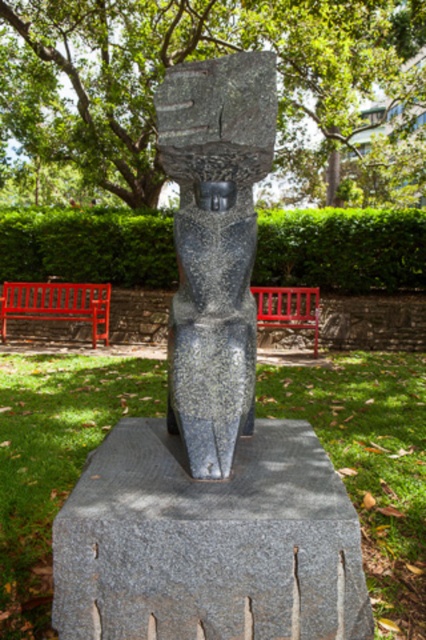
You are an artist planning to sketch the sculpture in the park. You notice two benches nearby. One is the red wooden bench at center and the other is the red painted wood bench at center. Which bench is positioned higher in the image?

The red wooden bench at center is located above the red painted wood bench at center, so the red wooden bench at center is positioned higher in the image.

You are a landscape architect designing a garden layout. You need to ensure that the gray granite pedestal at center and the green leafy hedge at center are visible from the main pathway. Considering their heights, which object might block the view of the other when viewed from the pathway?

The green leafy hedge at center is taller than the gray granite pedestal at center, so it might block the view of the pedestal if placed in front of it.

You are a visitor in the park and want to sit on the bench that is closer to the sculpture. Which bench should you choose between the red wooden bench at center and the red painted wood bench at center?

The red wooden bench at center is to the left of the red painted wood bench at center. Since the sculpture is positioned on a square stone platform on the grassy area, the red wooden bench at center being to the left would be closer to the sculpture compared to the red painted wood bench at center which is further to the right. Therefore, you should choose the red wooden bench at center.